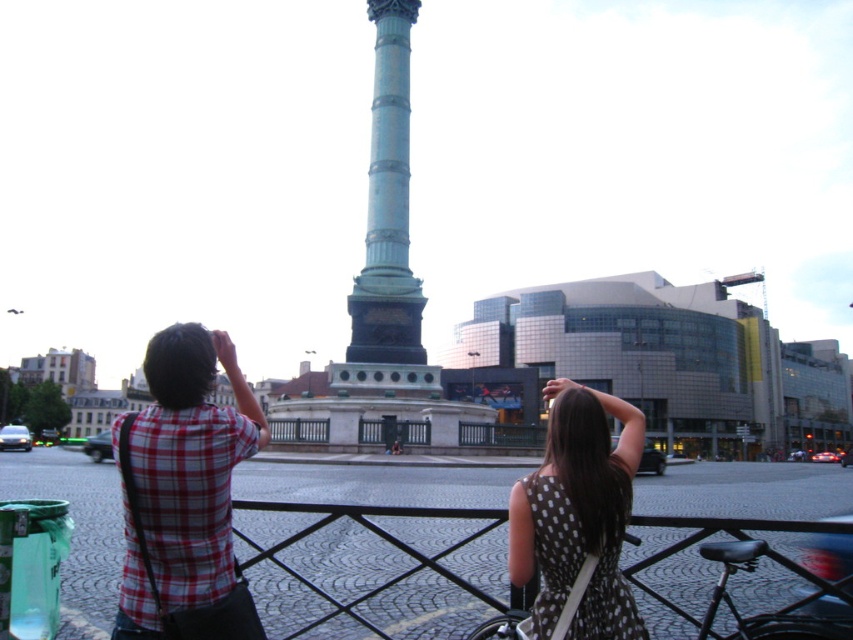
You are standing in the public square and see the polka dot dress at center and the green polished column at center. Which object is located to the right of the other?

The polka dot dress at center is positioned on the right side of green polished column at center.

You are a photographer trying to capture the green polished column at center in the background while also including the polka dot dress at center in the foreground. Given their sizes, which object will appear bigger in your photo?

The polka dot dress at center will appear bigger in the photo because it is larger in size than the green polished column at center.